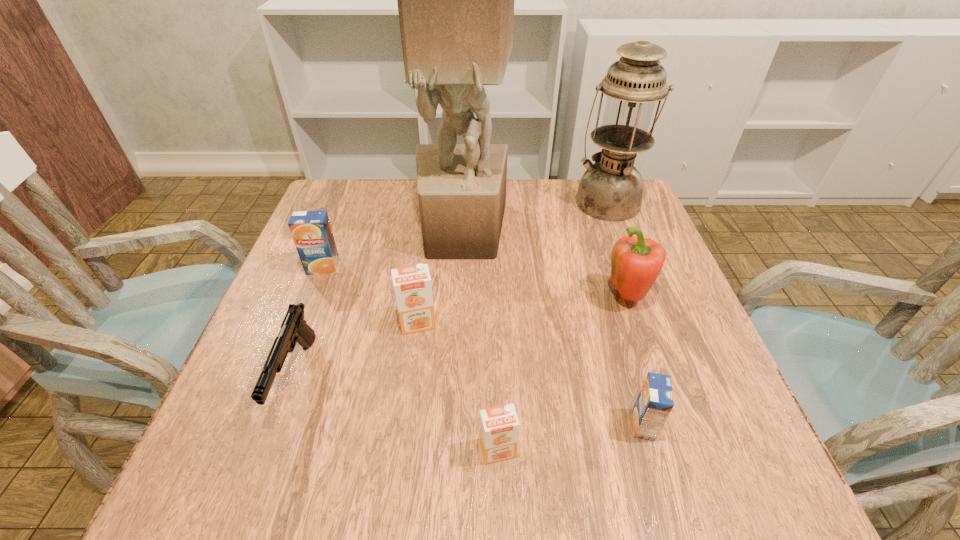
In order to click on empty space that is in between the left orange orange juice and the pepper in this screenshot , I will do `click(523, 310)`.

This screenshot has width=960, height=540. I want to click on vacant area between the gun and the pepper, so click(x=462, y=337).

Image resolution: width=960 pixels, height=540 pixels. Find the location of `free spot between the bigger orange orange juice and the nearer blue orange_juice`. free spot between the bigger orange orange juice and the nearer blue orange_juice is located at coordinates (531, 374).

This screenshot has height=540, width=960. I want to click on free space that is in between the sculpture and the rightmost orange juice, so click(553, 328).

The image size is (960, 540). Find the location of `unoccupied position between the bigger blue orange_juice and the orange pepper`. unoccupied position between the bigger blue orange_juice and the orange pepper is located at coordinates (476, 283).

The height and width of the screenshot is (540, 960). What are the coordinates of `vacant area that lies between the second tallest object and the smaller blue orange_juice` in the screenshot? It's located at (625, 313).

Identify which object is the nearest to the right blue orange_juice. Please provide its 2D coordinates. Your answer should be formatted as a tuple, i.e. [(x, y)], where the tuple contains the x and y coordinates of a point satisfying the conditions above.

[(499, 426)]

Identify which object is the seventh closest to the left orange orange juice. Please provide its 2D coordinates. Your answer should be formatted as a tuple, i.e. [(x, y)], where the tuple contains the x and y coordinates of a point satisfying the conditions above.

[(611, 189)]

Select which orange juice is the closest to the bigger orange orange juice. Please provide its 2D coordinates. Your answer should be formatted as a tuple, i.e. [(x, y)], where the tuple contains the x and y coordinates of a point satisfying the conditions above.

[(311, 230)]

Identify the location of orange juice that is the second closest to the sculpture. This screenshot has width=960, height=540. (311, 230).